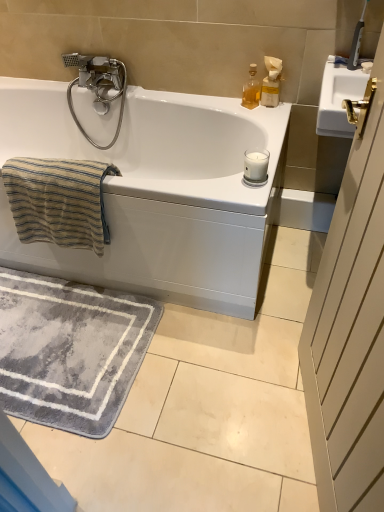
Question: Considering the relative sizes of white wood screen door at right and silver metallic faucet at upper left in the image provided, is white wood screen door at right shorter than silver metallic faucet at upper left?

Choices:
 (A) no
 (B) yes

Answer: (A)

Question: From the image's perspective, is white wood screen door at right over silver metallic faucet at upper left?

Choices:
 (A) no
 (B) yes

Answer: (A)

Question: Is white wood screen door at right bigger than silver metallic faucet at upper left?

Choices:
 (A) no
 (B) yes

Answer: (B)

Question: Considering the relative sizes of white wood screen door at right and silver metallic faucet at upper left in the image provided, is white wood screen door at right taller than silver metallic faucet at upper left?

Choices:
 (A) no
 (B) yes

Answer: (B)

Question: Would you say white wood screen door at right contains silver metallic faucet at upper left?

Choices:
 (A) yes
 (B) no

Answer: (B)

Question: Choose the correct answer: Is gray plush bath mat at lower left inside white plastic soap dispenser at upper right, the 1th soap dispenser positioned from the right, or outside it?

Choices:
 (A) outside
 (B) inside

Answer: (A)

Question: Based on their positions, is gray plush bath mat at lower left located to the left or right of white plastic soap dispenser at upper right, the second soap dispenser when ordered from left to right?

Choices:
 (A) left
 (B) right

Answer: (A)

Question: From their relative heights in the image, would you say gray plush bath mat at lower left is taller or shorter than white plastic soap dispenser at upper right, the second soap dispenser when ordered from left to right?

Choices:
 (A) short
 (B) tall

Answer: (A)

Question: From a real-world perspective, is gray plush bath mat at lower left above or below white plastic soap dispenser at upper right, the second soap dispenser when ordered from left to right?

Choices:
 (A) above
 (B) below

Answer: (B)

Question: Which is correct: beige striped towel at left is inside white wood screen door at right, or outside of it?

Choices:
 (A) outside
 (B) inside

Answer: (A)

Question: Considering the positions of beige striped towel at left and white wood screen door at right in the image, is beige striped towel at left taller or shorter than white wood screen door at right?

Choices:
 (A) short
 (B) tall

Answer: (A)

Question: Considering the positions of beige striped towel at left and white wood screen door at right in the image, is beige striped towel at left bigger or smaller than white wood screen door at right?

Choices:
 (A) big
 (B) small

Answer: (B)

Question: Based on their positions, is beige striped towel at left located to the left or right of white wood screen door at right?

Choices:
 (A) left
 (B) right

Answer: (A)

Question: Is beige striped towel at left wider or thinner than translucent glass bottle at upper right, arranged as the 1th soap dispenser when viewed from the left?

Choices:
 (A) thin
 (B) wide

Answer: (B)

Question: From the image's perspective, is beige striped towel at left located above or below translucent glass bottle at upper right, arranged as the 1th soap dispenser when viewed from the left?

Choices:
 (A) above
 (B) below

Answer: (B)